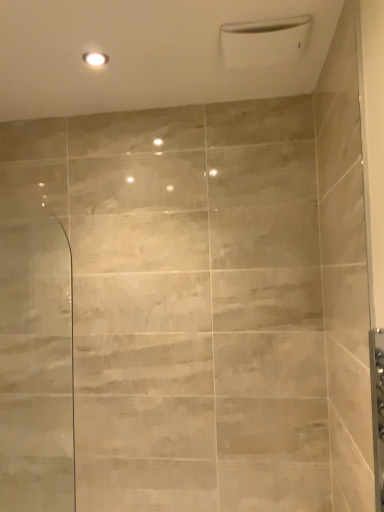
Question: Should I look upward or downward to see white glossy light fixture at upper center?

Choices:
 (A) down
 (B) up

Answer: (B)